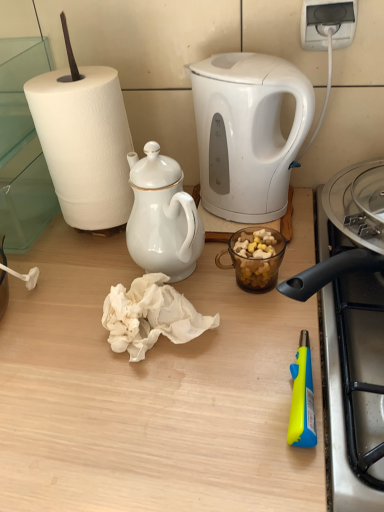
The width and height of the screenshot is (384, 512). I want to click on vacant space behind white crumpled paper towel at center, so click(127, 255).